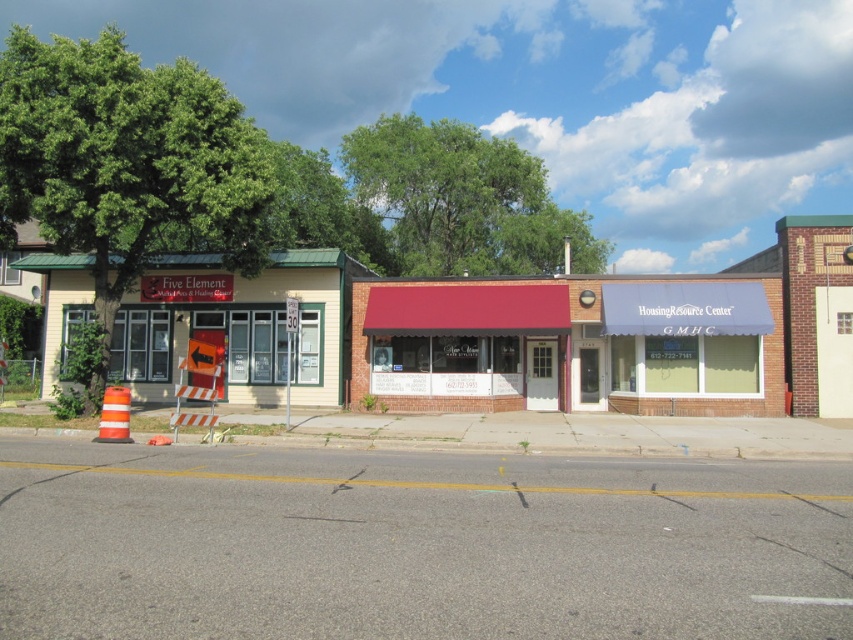
Question: Which point is closer to the camera?

Choices:
 (A) maroon fabric awning at center
 (B) yellow siding at left

Answer: (B)

Question: Considering the relative positions of maroon fabric awning at center and yellow siding at left in the image provided, where is maroon fabric awning at center located with respect to yellow siding at left?

Choices:
 (A) right
 (B) left

Answer: (A)

Question: Is maroon fabric awning at center below yellow siding at left?

Choices:
 (A) no
 (B) yes

Answer: (B)

Question: Is maroon fabric awning at center behind yellow siding at left?

Choices:
 (A) yes
 (B) no

Answer: (A)

Question: Which point appears farthest from the camera in this image?

Choices:
 (A) (625, 356)
 (B) (326, 349)

Answer: (B)

Question: Among these objects, which one is nearest to the camera?

Choices:
 (A) maroon fabric awning at center
 (B) yellow siding at left

Answer: (B)